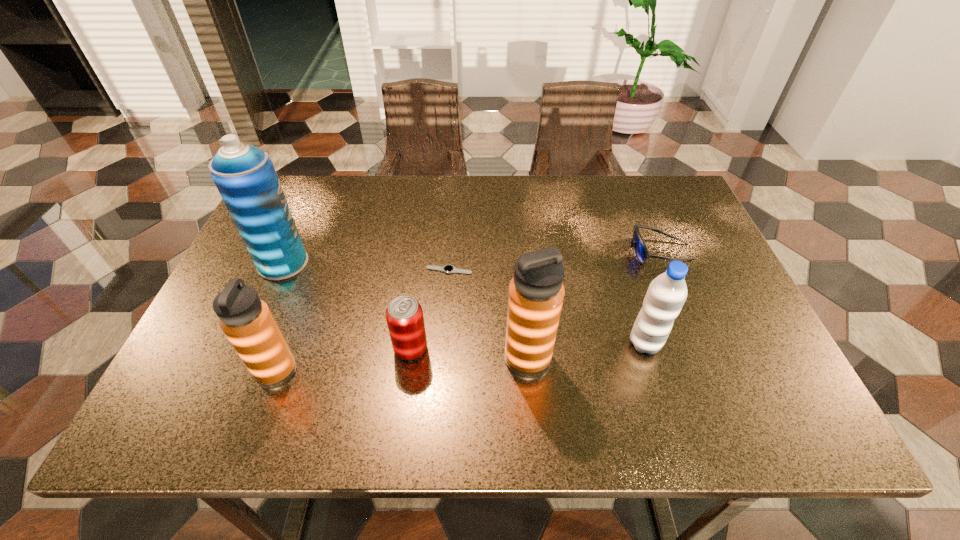
Locate an element on the screen. free space that satisfies the following two spatial constraints: 1. on the back side of the watch; 2. on the right side of the shorter thermos bottle is located at coordinates (314, 271).

Locate an element on the screen. The image size is (960, 540). vacant position in the image that satisfies the following two spatial constraints: 1. on the front-facing side of the sixth tallest object; 2. on the front side of the fifth tallest object is located at coordinates (702, 349).

Locate an element on the screen. free spot that satisfies the following two spatial constraints: 1. on the back side of the water bottle; 2. on the right side of the right thermos bottle is located at coordinates (526, 343).

Identify the location of vacant area in the image that satisfies the following two spatial constraints: 1. on the back side of the water bottle; 2. on the right side of the fifth object from left to right. (526, 343).

This screenshot has height=540, width=960. Find the location of `free region that satisfies the following two spatial constraints: 1. on the front-facing side of the second shortest object; 2. on the front side of the sixth shortest object`. free region that satisfies the following two spatial constraints: 1. on the front-facing side of the second shortest object; 2. on the front side of the sixth shortest object is located at coordinates (706, 358).